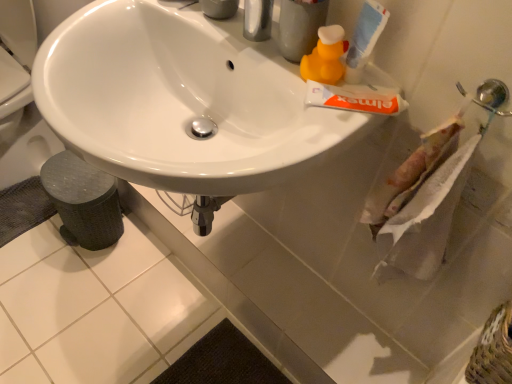
Question: Is white matte tube of toothpaste at upper right, which is counted as the first toothpaste, starting from the bottom, thinner than white glossy sink at center?

Choices:
 (A) yes
 (B) no

Answer: (A)

Question: From a real-world perspective, is white matte tube of toothpaste at upper right, marked as the second toothpaste in a top-to-bottom arrangement, physically above white glossy sink at center?

Choices:
 (A) no
 (B) yes

Answer: (B)

Question: From the image's perspective, is white matte tube of toothpaste at upper right, which is counted as the first toothpaste, starting from the bottom, located above white glossy sink at center?

Choices:
 (A) yes
 (B) no

Answer: (B)

Question: Does white matte tube of toothpaste at upper right, which is counted as the first toothpaste, starting from the bottom, appear on the right side of white glossy sink at center?

Choices:
 (A) no
 (B) yes

Answer: (B)

Question: Considering the relative positions of white matte tube of toothpaste at upper right, marked as the second toothpaste in a top-to-bottom arrangement, and white glossy sink at center in the image provided, is white matte tube of toothpaste at upper right, marked as the second toothpaste in a top-to-bottom arrangement, behind white glossy sink at center?

Choices:
 (A) yes
 (B) no

Answer: (A)

Question: Is point (266, 140) positioned closer to the camera than point (357, 18)?

Choices:
 (A) closer
 (B) farther

Answer: (B)

Question: Considering the positions of white glossy sink at center and white matte tube of toothpaste at upper right, which is counted as the 1th toothpaste, starting from the top, in the image, is white glossy sink at center wider or thinner than white matte tube of toothpaste at upper right, which is counted as the 1th toothpaste, starting from the top,?

Choices:
 (A) thin
 (B) wide

Answer: (B)

Question: Based on their sizes in the image, would you say white glossy sink at center is bigger or smaller than white matte tube of toothpaste at upper right, which is counted as the 1th toothpaste, starting from the top?

Choices:
 (A) small
 (B) big

Answer: (B)

Question: From the image's perspective, is white glossy sink at center located above or below white matte tube of toothpaste at upper right, which is counted as the 1th toothpaste, starting from the top?

Choices:
 (A) above
 (B) below

Answer: (B)

Question: Based on their sizes in the image, would you say white matte tube of toothpaste at upper right, acting as the 2th toothpaste starting from the bottom, is bigger or smaller than textured woven basket at lower right?

Choices:
 (A) big
 (B) small

Answer: (B)

Question: Looking at their shapes, would you say white matte tube of toothpaste at upper right, acting as the 2th toothpaste starting from the bottom, is wider or thinner than textured woven basket at lower right?

Choices:
 (A) thin
 (B) wide

Answer: (A)

Question: Considering the positions of point (377, 34) and point (501, 326), is point (377, 34) closer or farther from the camera than point (501, 326)?

Choices:
 (A) farther
 (B) closer

Answer: (A)

Question: Choose the correct answer: Is white matte tube of toothpaste at upper right, which is counted as the 1th toothpaste, starting from the top, inside textured woven basket at lower right or outside it?

Choices:
 (A) outside
 (B) inside

Answer: (A)

Question: Considering their positions, is white glossy sink at center located in front of or behind white paper towel at right?

Choices:
 (A) front
 (B) behind

Answer: (A)

Question: Is point (150, 172) positioned closer to the camera than point (374, 268)?

Choices:
 (A) farther
 (B) closer

Answer: (B)